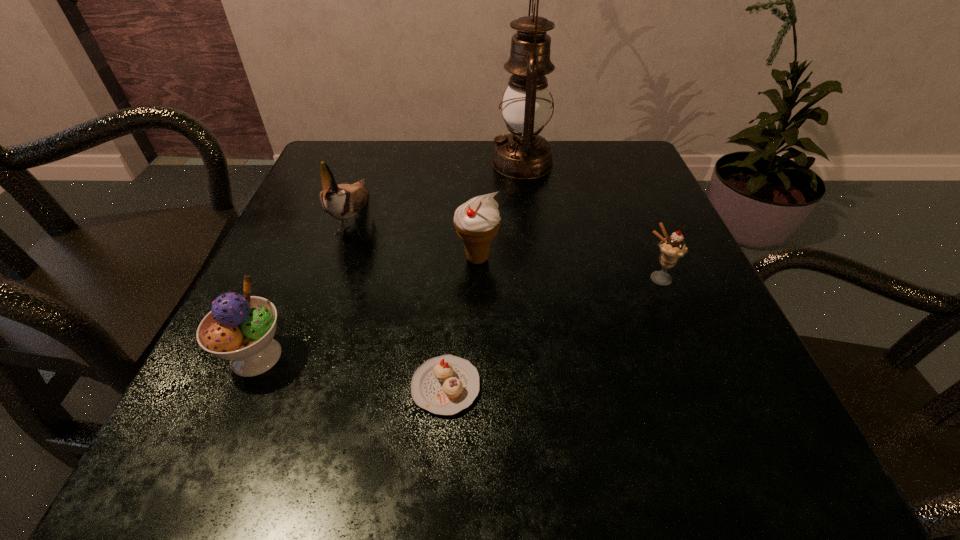
Identify the location of vacant space at the far edge. Image resolution: width=960 pixels, height=540 pixels. (535, 184).

Where is `blank space at the near edge`? blank space at the near edge is located at coordinates (509, 420).

Find the location of a particular element. The image size is (960, 540). free region at the left edge of the desktop is located at coordinates (303, 230).

Find the location of a particular element. free space at the right edge is located at coordinates (707, 362).

Find the location of a particular element. vacant space at the far right corner of the desktop is located at coordinates (606, 145).

In the image, there is a desktop. Identify the location of vacant space at the near right corner. The width and height of the screenshot is (960, 540). (710, 423).

Locate an element on the screen. Image resolution: width=960 pixels, height=540 pixels. free space between the third tallest object and the second tallest object is located at coordinates (416, 238).

Where is `free spot between the cupcake and the rightmost object`? The image size is (960, 540). free spot between the cupcake and the rightmost object is located at coordinates (551, 333).

Identify the location of vacant point located between the leftmost icecream and the oil lamp. Image resolution: width=960 pixels, height=540 pixels. (390, 260).

Identify the location of free space between the second icecream from right to left and the tallest object. (500, 211).